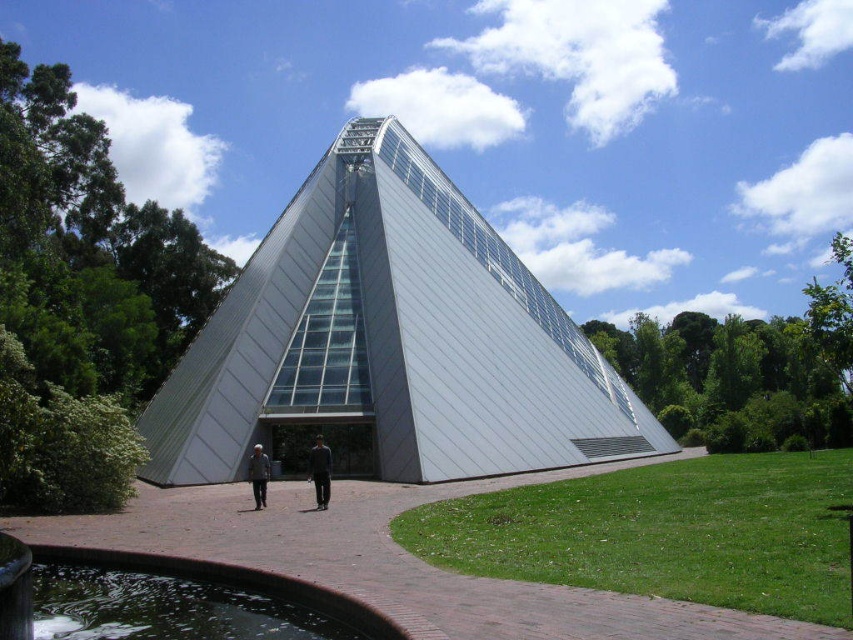
You are a maintenance worker tasked with placing the gray fabric jacket at center on the brick path at center. Considering their sizes, will the jacket fit entirely on the path without hanging over the edges?

The brick path at center is wider than the gray fabric jacket at center, so the jacket will fit entirely on the path without any part hanging over the edges.